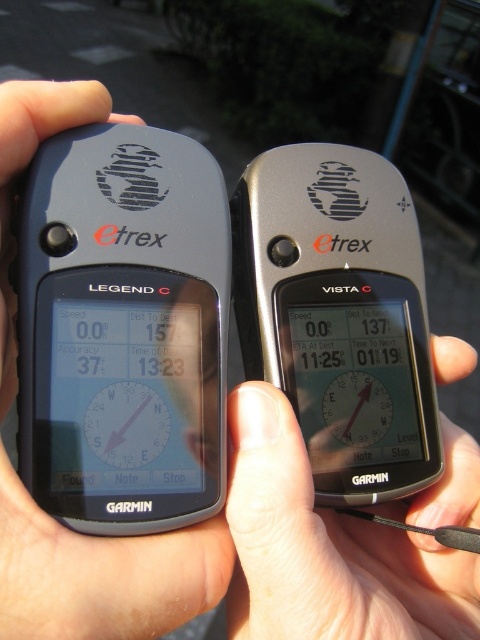
Question: Considering the relative positions of skinny silver phone at center and matte black clock at center in the image provided, where is skinny silver phone at center located with respect to matte black clock at center?

Choices:
 (A) right
 (B) left

Answer: (A)

Question: Which of the following is the farthest from the observer?

Choices:
 (A) matte black clock at center
 (B) black matte gps device at center

Answer: (A)

Question: Which point is closer to the camera?

Choices:
 (A) (387, 589)
 (B) (131, 428)
 (C) (179, 618)

Answer: (C)

Question: Can you confirm if black matte gps device at center is positioned to the left of matte black clock at center?

Choices:
 (A) yes
 (B) no

Answer: (A)

Question: Which object is the farthest from the black matte gps device at center?

Choices:
 (A) matte black clock at center
 (B) skinny silver phone at center

Answer: (B)

Question: Is black matte gps device at center smaller than matte black clock at center?

Choices:
 (A) no
 (B) yes

Answer: (A)